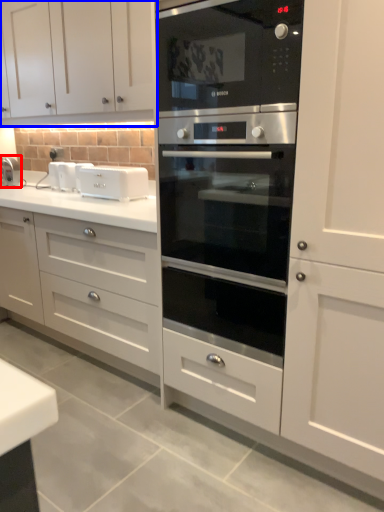
Question: Among these objects, which one is nearest to the camera, faucet (highlighted by a red box) or cabinetry (highlighted by a blue box)?

Choices:
 (A) faucet
 (B) cabinetry

Answer: (B)